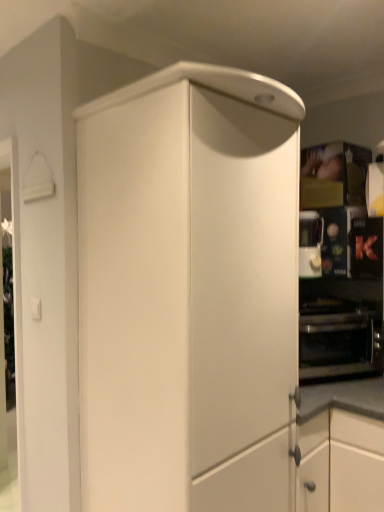
Question: Is black metallic oven at right far from satin silver coffee machine at right?

Choices:
 (A) yes
 (B) no

Answer: (B)

Question: Does black metallic oven at right appear on the left side of satin silver coffee machine at right?

Choices:
 (A) yes
 (B) no

Answer: (B)

Question: Considering the relative sizes of black metallic oven at right and satin silver coffee machine at right in the image provided, is black metallic oven at right smaller than satin silver coffee machine at right?

Choices:
 (A) no
 (B) yes

Answer: (A)

Question: Is satin silver coffee machine at right a part of black metallic oven at right?

Choices:
 (A) yes
 (B) no

Answer: (B)

Question: Does black metallic oven at right turn towards satin silver coffee machine at right?

Choices:
 (A) yes
 (B) no

Answer: (B)

Question: Does black metallic oven at right have a larger size compared to satin silver coffee machine at right?

Choices:
 (A) yes
 (B) no

Answer: (A)

Question: From a real-world perspective, is black matte oven at right positioned under matte white cabinet at center based on gravity?

Choices:
 (A) no
 (B) yes

Answer: (A)

Question: Is black matte oven at right shorter than matte white cabinet at center?

Choices:
 (A) yes
 (B) no

Answer: (A)

Question: From a real-world perspective, is black matte oven at right physically above matte white cabinet at center?

Choices:
 (A) yes
 (B) no

Answer: (A)

Question: Does black matte oven at right have a greater height compared to matte white cabinet at center?

Choices:
 (A) yes
 (B) no

Answer: (B)

Question: Does black matte oven at right have a greater width compared to matte white cabinet at center?

Choices:
 (A) yes
 (B) no

Answer: (B)

Question: Does black matte oven at right have a smaller size compared to matte white cabinet at center?

Choices:
 (A) no
 (B) yes

Answer: (B)

Question: Does satin silver coffee machine at right come behind black metallic oven at right?

Choices:
 (A) yes
 (B) no

Answer: (A)